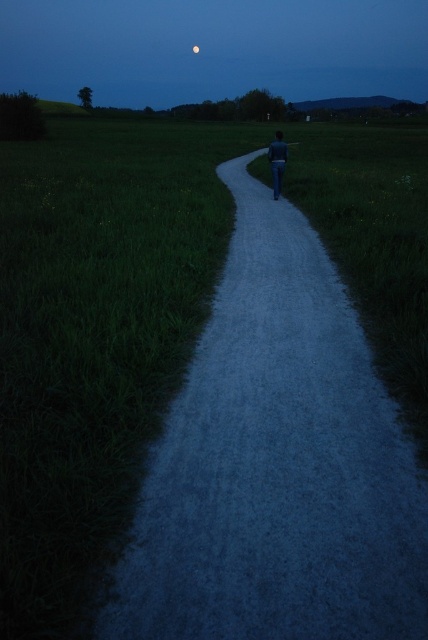
You are a photographer standing at the camera position. You want to take a picture of the full moon at upper center. However, you notice that the moon appears too small in your current frame. What can you do to make the moon appear larger in your photo?

To make the full moon at upper center appear larger in your photo, you can move closer to it. Since it is 139.55 meters away from the camera, reducing this distance will increase its apparent size in the frame.

You are an astronomer observing the night sky and notice two moons in the scene. Which moon, the full moon at upper center or the silvery reflective moon at upper center, appears closer to you?

The full moon at upper center appears closer to you because it is positioned further to the viewer than the silvery reflective moon at upper center.